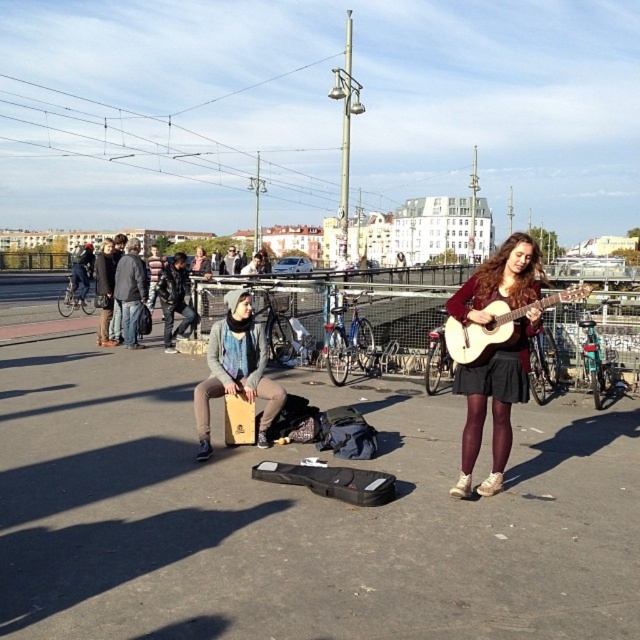
Question: Among these points, which one is farthest from the camera?

Choices:
 (A) (496, 492)
 (B) (228, 256)
 (C) (499, 314)

Answer: (B)

Question: Estimate the real-world distances between objects in this image. Which object is farther from the leather jacket at center?

Choices:
 (A) matte brown guitar at center
 (B) dark gray hoodie at center
 (C) acoustic wood guitar at right

Answer: (A)

Question: Does matte brown guitar at center have a lesser width compared to acoustic wood guitar at right?

Choices:
 (A) no
 (B) yes

Answer: (B)

Question: Is matte brown guitar at center to the right of dark gray hoodie at center from the viewer's perspective?

Choices:
 (A) no
 (B) yes

Answer: (B)

Question: Which of these objects is positioned closest to the acoustic wood guitar at right?

Choices:
 (A) leather jacket at center
 (B) dark gray hoodie at center
 (C) matte brown guitar at center

Answer: (C)

Question: From the image, what is the correct spatial relationship of matte brown guitar at center in relation to acoustic wood guitar at right?

Choices:
 (A) below
 (B) above

Answer: (A)